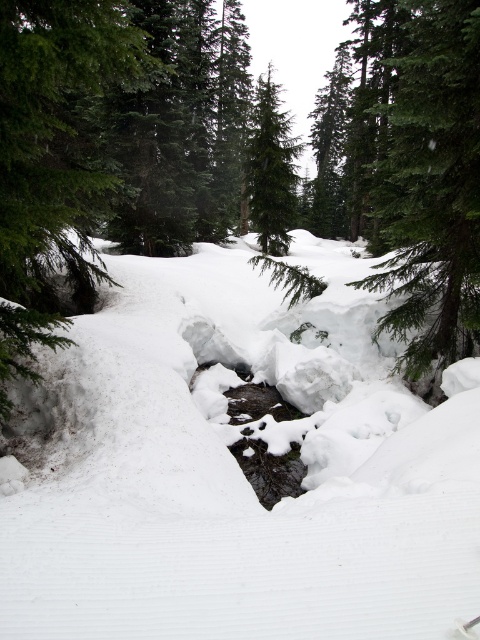
You are standing in the snowy forest and see two trees in the center of the image, a green textured tree at center and a green matte tree at center. Which tree would appear larger to you?

The green textured tree at center appears larger because it is closer to the viewer than the green matte tree at center.

You are standing in the winter forest scene and want to place a small snowman exactly at the center of the image. Is the white fluffy snow at center suitable for building the snowman?

The white fluffy snow at center is located at point [238,468], which is not exactly the center of the image. Therefore, it might not be suitable for building the snowman at the exact center.